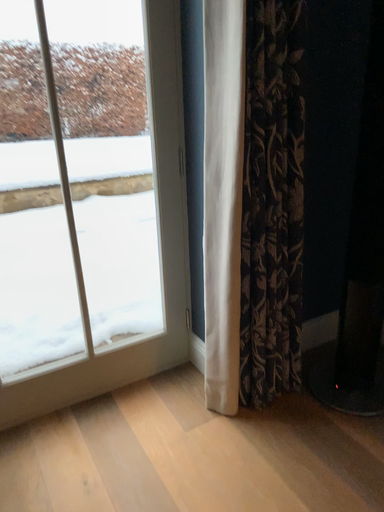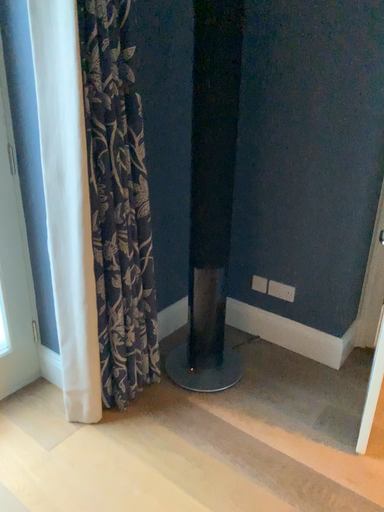
Question: Which way did the camera rotate in the video?

Choices:
 (A) rotated right
 (B) rotated left

Answer: (A)